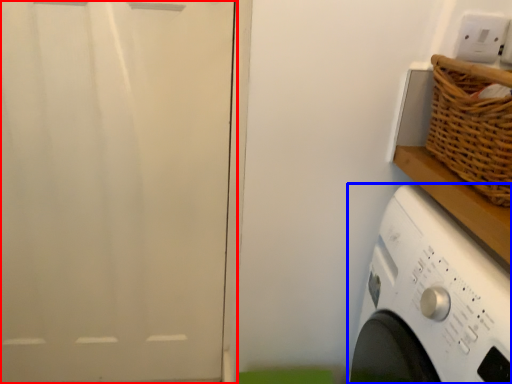
Question: Among these objects, which one is farthest to the camera, screen door (highlighted by a red box) or washing machine (highlighted by a blue box)?

Choices:
 (A) screen door
 (B) washing machine

Answer: (A)